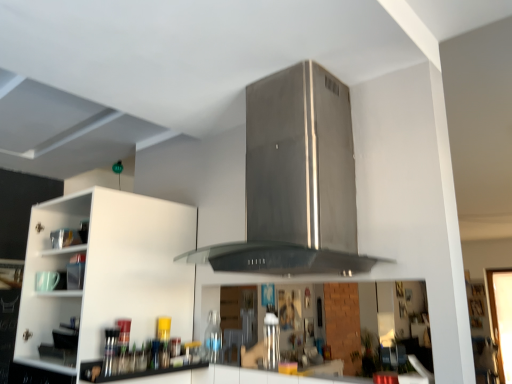
Question: Considering their positions, is stainless steel vent at center located in front of or behind transparent glass bottle at center?

Choices:
 (A) behind
 (B) front

Answer: (B)

Question: Looking at the image, does stainless steel vent at center seem bigger or smaller compared to transparent glass bottle at center?

Choices:
 (A) small
 (B) big

Answer: (B)

Question: Considering the real-world distances, which object is closest to the satin silver canister at center?

Choices:
 (A) transparent glass bottle at center
 (B) white matte cabinet at left
 (C) stainless steel vent at center

Answer: (A)

Question: Which object is positioned farthest from the satin silver canister at center?

Choices:
 (A) white matte cabinet at left
 (B) stainless steel vent at center
 (C) transparent glass bottle at center

Answer: (A)